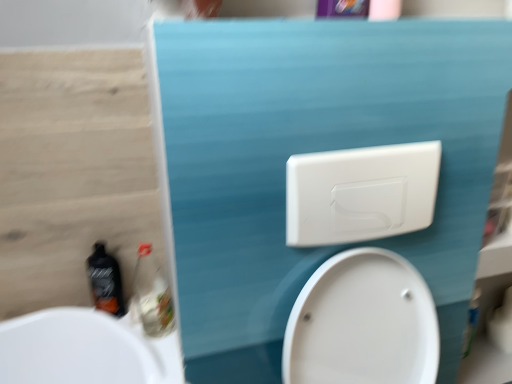
Question: From a real-world perspective, is white matte toilet paper at lower right positioned above or below white glossy toilet at center?

Choices:
 (A) above
 (B) below

Answer: (B)

Question: Considering the positions of white matte toilet paper at lower right and white glossy toilet at center in the image, is white matte toilet paper at lower right wider or thinner than white glossy toilet at center?

Choices:
 (A) wide
 (B) thin

Answer: (B)

Question: Which object is positioned closest to the translucent plastic bottle at lower left?

Choices:
 (A) wooden at left
 (B) black plastic bottle at lower left
 (C) white plastic toilet flush handle at upper center
 (D) white matte toilet paper at lower right
 (E) white glossy toilet at center

Answer: (B)

Question: Which is farther from the white plastic toilet flush handle at upper center?

Choices:
 (A) black plastic bottle at lower left
 (B) white matte toilet paper at lower right
 (C) wooden at left
 (D) white glossy toilet at center
 (E) translucent plastic bottle at lower left

Answer: (B)